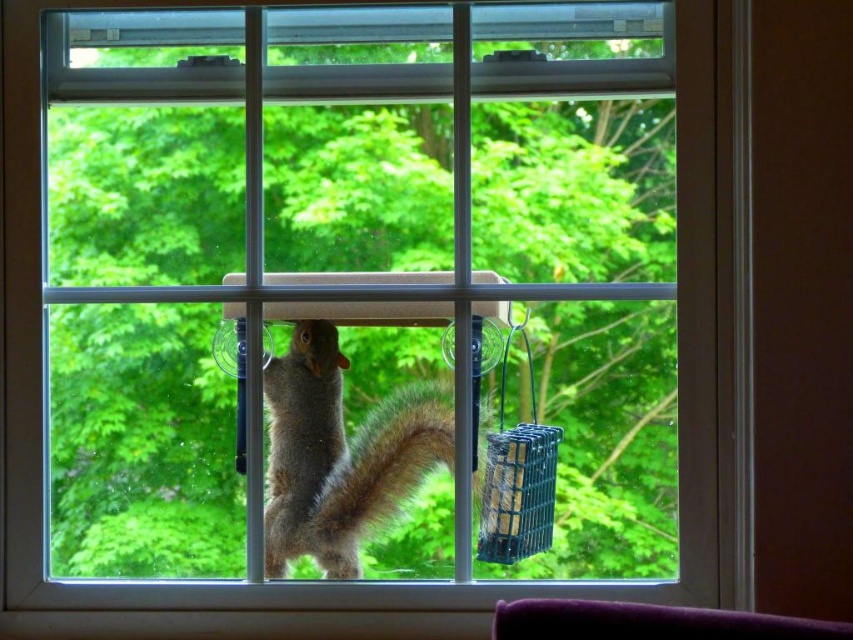
You are a bird watching enthusiast who wants to ensure the bird feeder is visible to birds. Considering the fuzzy brown squirrel at center and the green plastic bird feeder at right, which one is taller and might block the view of the feeder?

The fuzzy brown squirrel at center is taller than the green plastic bird feeder at right, so it might block the view of the feeder.

You are an interior designer planning to place a new decorative item on the windowsill. The windowsill is currently occupied by the fuzzy brown squirrel at center and the green plastic bird feeder at right. If the squirrel moves away, which object would you have more space to place a larger item next to?

The green plastic bird feeder at right would allow more space for a larger item since the fuzzy brown squirrel at center might be wider than the feeder.